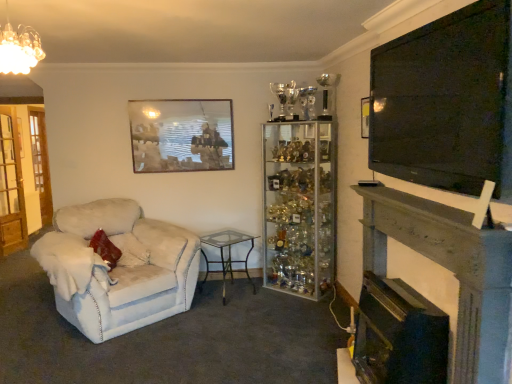
Question: Is black glossy fireplace at lower right, placed as the second fireplace when sorted from right to left, further to camera compared to clear glass trophy cabinet at center?

Choices:
 (A) no
 (B) yes

Answer: (A)

Question: Considering the relative sizes of black glossy fireplace at lower right, arranged as the first fireplace when viewed from the left, and clear glass trophy cabinet at center in the image provided, is black glossy fireplace at lower right, arranged as the first fireplace when viewed from the left, taller than clear glass trophy cabinet at center?

Choices:
 (A) no
 (B) yes

Answer: (A)

Question: Is black glossy fireplace at lower right, arranged as the first fireplace when viewed from the left, wider than clear glass trophy cabinet at center?

Choices:
 (A) yes
 (B) no

Answer: (B)

Question: Is black glossy fireplace at lower right, placed as the second fireplace when sorted from right to left, smaller than clear glass trophy cabinet at center?

Choices:
 (A) yes
 (B) no

Answer: (A)

Question: From the image's perspective, does black glossy fireplace at lower right, arranged as the first fireplace when viewed from the left, appear higher than clear glass trophy cabinet at center?

Choices:
 (A) no
 (B) yes

Answer: (A)

Question: Is black glossy fireplace at lower right, placed as the second fireplace when sorted from right to left, inside the boundaries of clear glass table at center, or outside?

Choices:
 (A) inside
 (B) outside

Answer: (B)

Question: Is black glossy fireplace at lower right, placed as the second fireplace when sorted from right to left, to the left or to the right of clear glass table at center in the image?

Choices:
 (A) left
 (B) right

Answer: (B)

Question: Looking at their shapes, would you say black glossy fireplace at lower right, arranged as the first fireplace when viewed from the left, is wider or thinner than clear glass table at center?

Choices:
 (A) wide
 (B) thin

Answer: (B)

Question: Is point (379, 322) positioned closer to the camera than point (242, 271)?

Choices:
 (A) farther
 (B) closer

Answer: (B)

Question: Is clear glass table at center taller or shorter than black glossy fireplace at lower right, arranged as the first fireplace when viewed from the left?

Choices:
 (A) short
 (B) tall

Answer: (A)

Question: In terms of size, does clear glass table at center appear bigger or smaller than black glossy fireplace at lower right, placed as the second fireplace when sorted from right to left?

Choices:
 (A) small
 (B) big

Answer: (B)

Question: From the image's perspective, is clear glass table at center positioned above or below black glossy fireplace at lower right, placed as the second fireplace when sorted from right to left?

Choices:
 (A) below
 (B) above

Answer: (B)

Question: Would you say clear glass table at center is to the left or to the right of black glossy fireplace at lower right, placed as the second fireplace when sorted from right to left, in the picture?

Choices:
 (A) right
 (B) left

Answer: (B)

Question: Is velvet beige armchair at left spatially inside black glossy fireplace at lower right, arranged as the first fireplace when viewed from the left, or outside of it?

Choices:
 (A) inside
 (B) outside

Answer: (B)

Question: Is velvet beige armchair at left taller or shorter than black glossy fireplace at lower right, placed as the second fireplace when sorted from right to left?

Choices:
 (A) tall
 (B) short

Answer: (A)